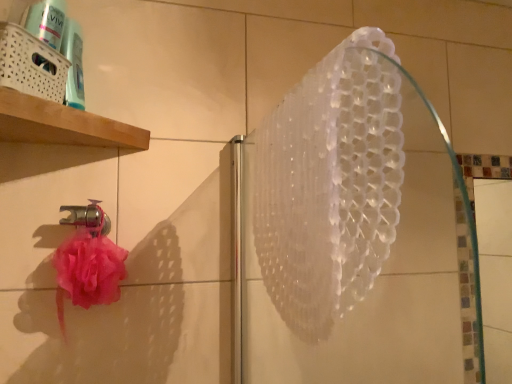
Question: Is white woven basket at upper left taller than metallic silver faucet at lower left?

Choices:
 (A) yes
 (B) no

Answer: (B)

Question: Does white woven basket at upper left have a larger size compared to metallic silver faucet at lower left?

Choices:
 (A) no
 (B) yes

Answer: (B)

Question: From the image's perspective, is white woven basket at upper left above metallic silver faucet at lower left?

Choices:
 (A) no
 (B) yes

Answer: (B)

Question: Is white woven basket at upper left at the left side of metallic silver faucet at lower left?

Choices:
 (A) yes
 (B) no

Answer: (B)

Question: Considering the relative sizes of white woven basket at upper left and metallic silver faucet at lower left in the image provided, is white woven basket at upper left shorter than metallic silver faucet at lower left?

Choices:
 (A) yes
 (B) no

Answer: (A)

Question: Is white woven basket at upper left spatially inside metallic silver faucet at lower left, or outside of it?

Choices:
 (A) outside
 (B) inside

Answer: (A)

Question: From the image's perspective, relative to metallic silver faucet at lower left, is white woven basket at upper left above or below?

Choices:
 (A) below
 (B) above

Answer: (B)

Question: In the image, is white woven basket at upper left positioned in front of or behind metallic silver faucet at lower left?

Choices:
 (A) front
 (B) behind

Answer: (A)

Question: Looking at the image, does white woven basket at upper left seem bigger or smaller compared to metallic silver faucet at lower left?

Choices:
 (A) big
 (B) small

Answer: (A)

Question: Relative to white woven basket at upper left, is transparent plastic shower at upper center in front or behind?

Choices:
 (A) behind
 (B) front

Answer: (B)

Question: From a real-world perspective, relative to white woven basket at upper left, is transparent plastic shower at upper center vertically above or below?

Choices:
 (A) above
 (B) below

Answer: (B)

Question: Is transparent plastic shower at upper center inside or outside of white woven basket at upper left?

Choices:
 (A) inside
 (B) outside

Answer: (B)

Question: Considering the positions of transparent plastic shower at upper center and white woven basket at upper left in the image, is transparent plastic shower at upper center taller or shorter than white woven basket at upper left?

Choices:
 (A) short
 (B) tall

Answer: (B)

Question: Based on their positions, is transparent plastic shower at upper center located to the left or right of metallic silver faucet at lower left?

Choices:
 (A) right
 (B) left

Answer: (A)

Question: Is point (373, 76) positioned closer to the camera than point (69, 206)?

Choices:
 (A) farther
 (B) closer

Answer: (B)